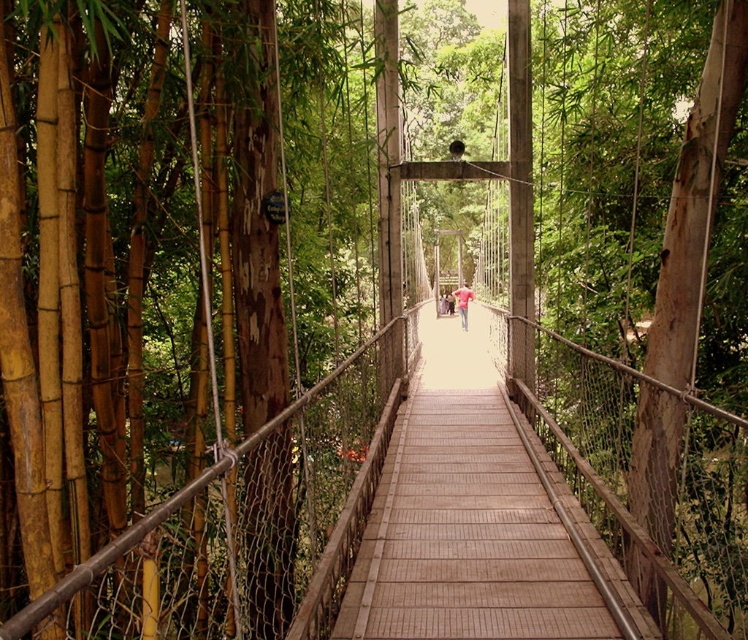
Question: Can you confirm if wooden bridge at center is bigger than pink fabric shirt at center?

Choices:
 (A) yes
 (B) no

Answer: (B)

Question: Which point is closer to the camera taking this photo?

Choices:
 (A) (465, 317)
 (B) (505, 584)

Answer: (B)

Question: Does wooden bridge at center come behind pink fabric shirt at center?

Choices:
 (A) no
 (B) yes

Answer: (A)

Question: Which object appears closest to the camera in this image?

Choices:
 (A) wooden bridge at center
 (B) pink fabric shirt at center

Answer: (A)

Question: Does wooden bridge at center have a larger size compared to pink fabric shirt at center?

Choices:
 (A) yes
 (B) no

Answer: (B)